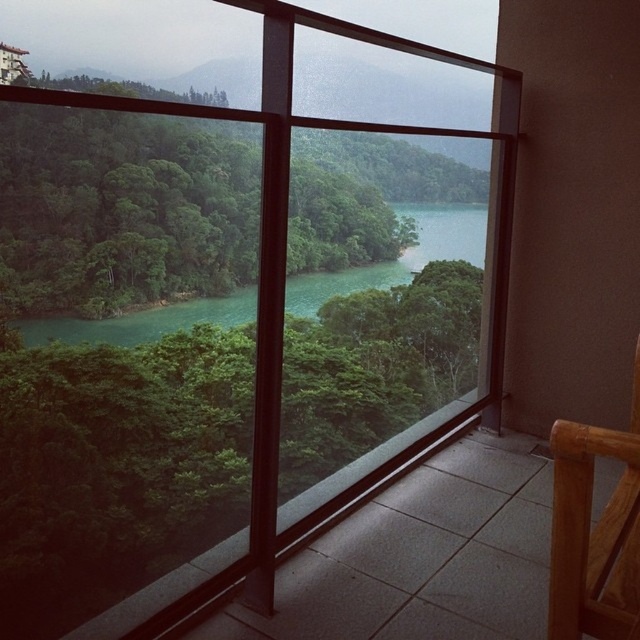
Question: Does green leafy tree at center have a greater width compared to bamboo chair at lower right?

Choices:
 (A) no
 (B) yes

Answer: (A)

Question: Among these points, which one is nearest to the camera?

Choices:
 (A) (548, 616)
 (B) (67, 164)

Answer: (A)

Question: Is green leafy tree at center in front of bamboo chair at lower right?

Choices:
 (A) yes
 (B) no

Answer: (B)

Question: Which of the following is the farthest from the observer?

Choices:
 (A) bamboo chair at lower right
 (B) green leafy tree at center

Answer: (B)

Question: Observing the image, what is the correct spatial positioning of green leafy tree at center in reference to bamboo chair at lower right?

Choices:
 (A) right
 (B) left

Answer: (B)